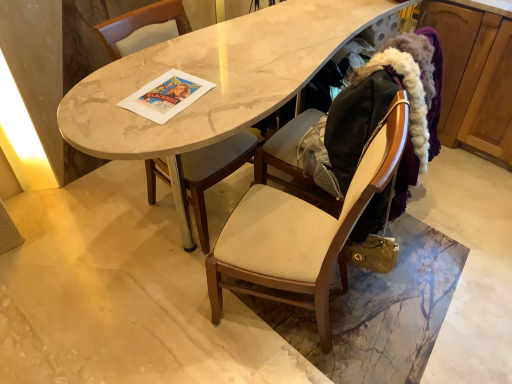
Where is `free space above marble table at center (from a real-world perspective)`? Image resolution: width=512 pixels, height=384 pixels. free space above marble table at center (from a real-world perspective) is located at coordinates (246, 54).